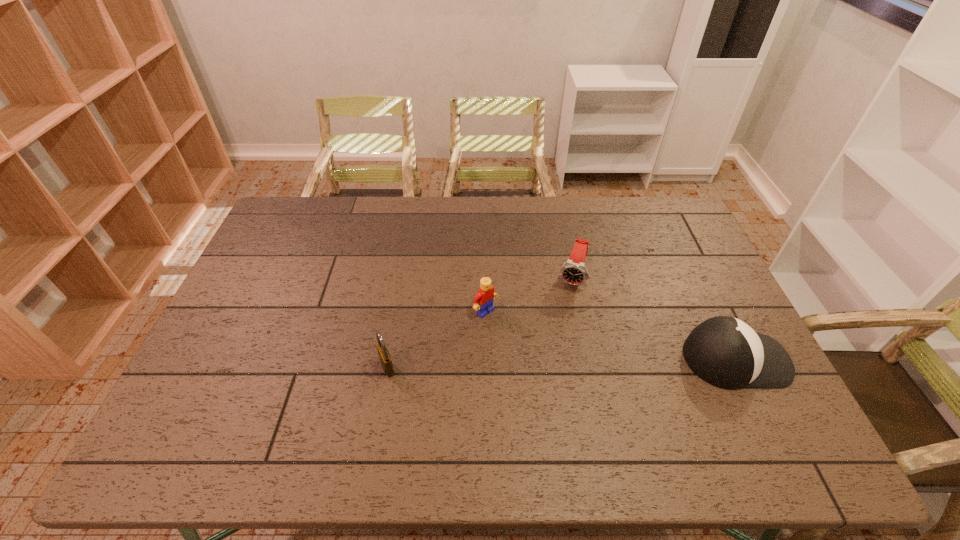
Where is `free space between the watch and the third nearest object`? The image size is (960, 540). free space between the watch and the third nearest object is located at coordinates (529, 294).

Where is `the closest object relative to the Lego`? the closest object relative to the Lego is located at coordinates (573, 271).

Identify which object is the nearest to the leftmost object. Please provide its 2D coordinates. Your answer should be formatted as a tuple, i.e. [(x, y)], where the tuple contains the x and y coordinates of a point satisfying the conditions above.

[(483, 300)]

At what (x,y) coordinates should I click in order to perform the action: click on free space that satisfies the following two spatial constraints: 1. on the back side of the leftmost object; 2. on the front panel of the cap. Please return your answer as a coordinate pair (x, y). This screenshot has height=540, width=960. Looking at the image, I should click on 389,359.

Locate an element on the screen. vacant point that satisfies the following two spatial constraints: 1. on the back side of the leftmost object; 2. on the left side of the watch is located at coordinates (403, 278).

Where is `vacant space that satisfies the following two spatial constraints: 1. on the front side of the cap; 2. on the front panel of the Lego`? This screenshot has height=540, width=960. vacant space that satisfies the following two spatial constraints: 1. on the front side of the cap; 2. on the front panel of the Lego is located at coordinates (486, 359).

Where is `vacant area in the image that satisfies the following two spatial constraints: 1. on the back side of the leftmost object; 2. on the left side of the farthest object`? The image size is (960, 540). vacant area in the image that satisfies the following two spatial constraints: 1. on the back side of the leftmost object; 2. on the left side of the farthest object is located at coordinates (403, 278).